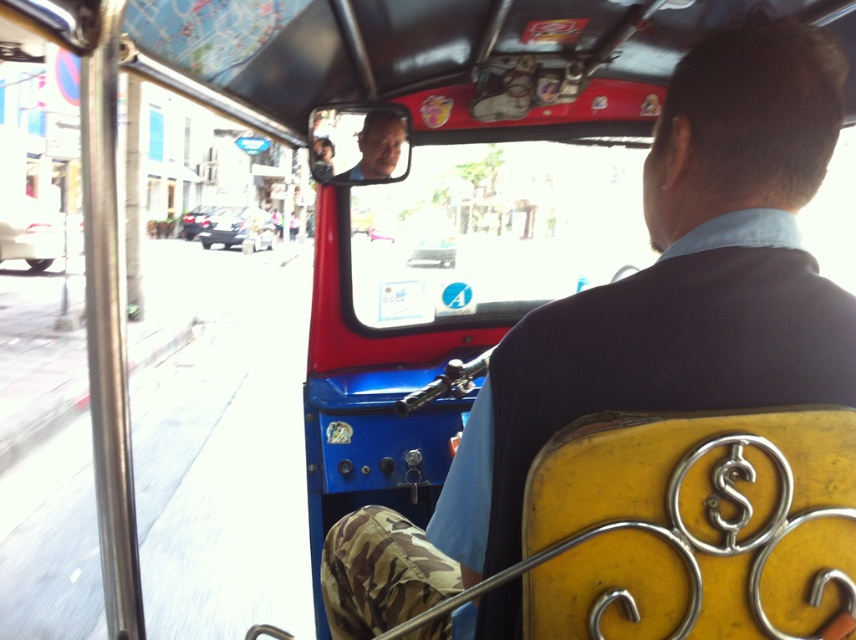
Who is shorter, matte black vest at center or matte black face at center?

matte black face at center

Does point (602, 296) come farther from viewer compared to point (379, 177)?

No, (602, 296) is closer to viewer.

Where is `matte black vest at center`? This screenshot has height=640, width=856. matte black vest at center is located at coordinates (645, 317).

How much distance is there between matte black vest at center and metallic silver car at left?

matte black vest at center and metallic silver car at left are 79.76 feet apart.

Can you confirm if matte black vest at center is taller than metallic silver car at left?

Incorrect, matte black vest at center's height is not larger of metallic silver car at left's.

Measure the distance between matte black vest at center and camera.

The distance of matte black vest at center from camera is 31.85 inches.

In order to click on matte black vest at center in this screenshot , I will do `click(645, 317)`.

Is matte black face at center closer to camera compared to metallic silver car at left?

Yes, matte black face at center is in front of metallic silver car at left.

This screenshot has width=856, height=640. What do you see at coordinates (377, 145) in the screenshot?
I see `matte black face at center` at bounding box center [377, 145].

Find the location of a particular element. This screenshot has width=856, height=640. matte black face at center is located at coordinates (377, 145).

This screenshot has height=640, width=856. In order to click on matte black face at center in this screenshot , I will do `click(377, 145)`.